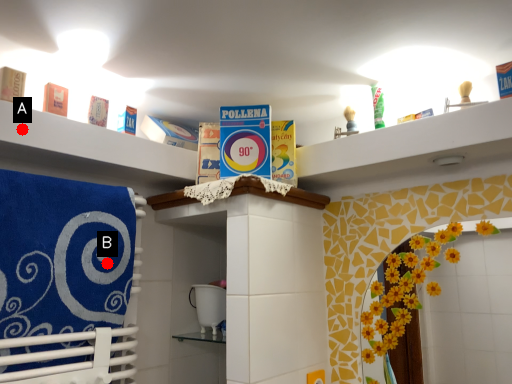
Question: Two points are circled on the image, labeled by A and B beside each circle. Which point is closer to the camera taking this photo?

Choices:
 (A) A is closer
 (B) B is closer

Answer: (A)